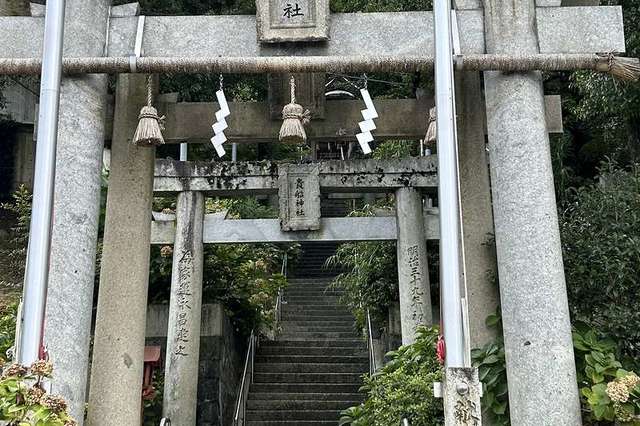
Locate an element on the screen. The width and height of the screenshot is (640, 426). leftmost hand rail is located at coordinates (244, 383).